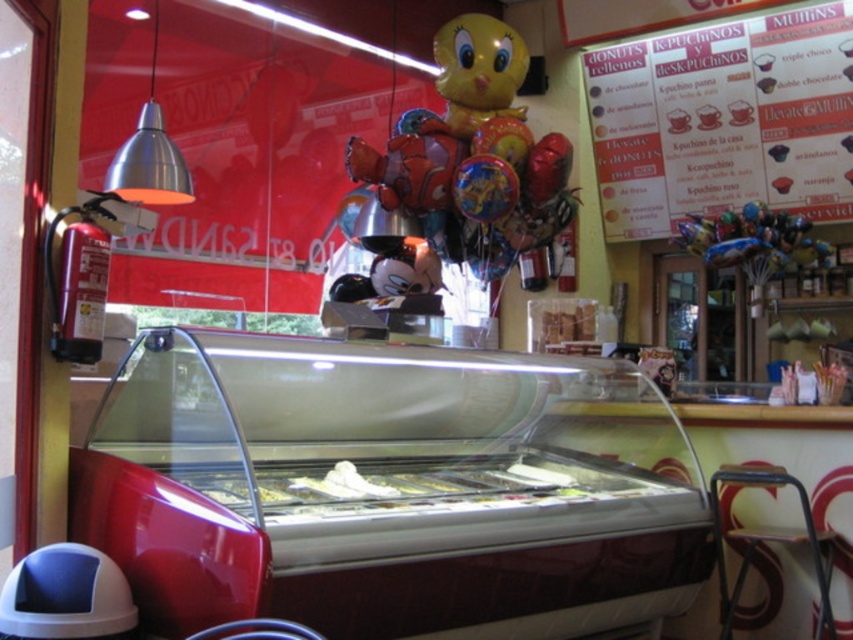
You are a customer entering the ice cream shop and want to read the red paper poster at upper right. However, there is a metallic silver stool at lower right in your way. Can you see the entire poster without moving the stool?

The red paper poster at upper right is taller than the metallic silver stool at lower right, so you can see the entire poster without moving the stool because the poster extends higher than the stool.

Consider the image. You are a customer looking at the ice cream display case. You see a red paper poster at upper right and a yellow metallic balloon at center. Which object is located more to the right side?

The red paper poster at upper right is positioned on the right side of the yellow metallic balloon at center, so it is more to the right.

In the scene shown: You are a customer entering the ice cream shop and want to sit down. You see the yellow metallic balloon at center and the metallic silver stool at lower right. Which object is closer to the entrance?

The metallic silver stool at lower right is closer to the entrance because it is positioned at the lower right, which is typically near the entrance area in such layouts.